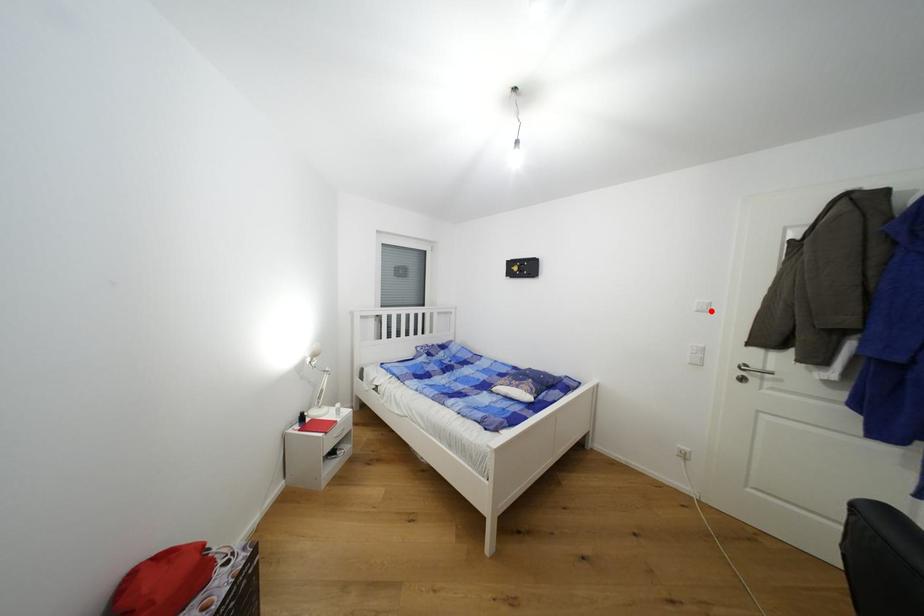
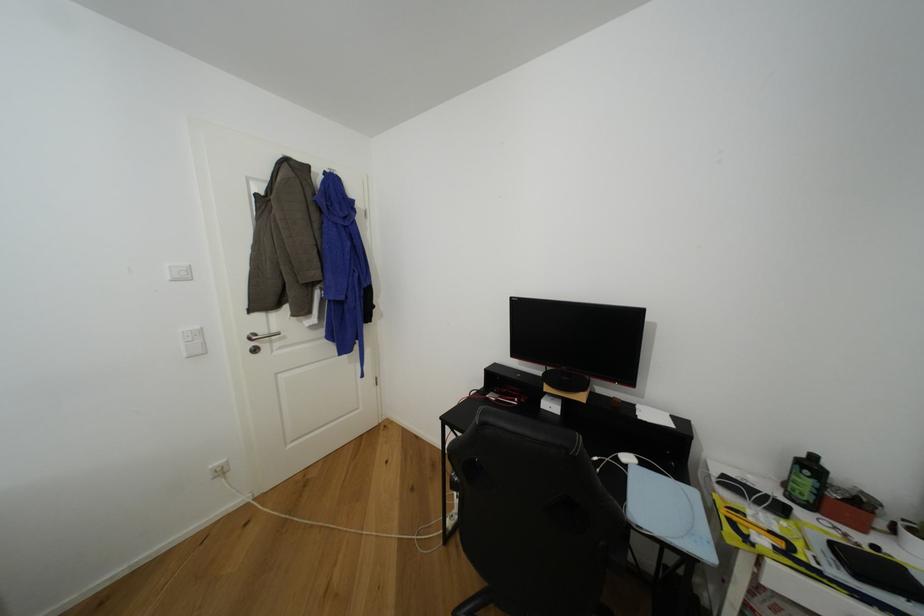
Locate, in the second image, the point that corresponds to the highlighted location in the first image.

(190, 278)